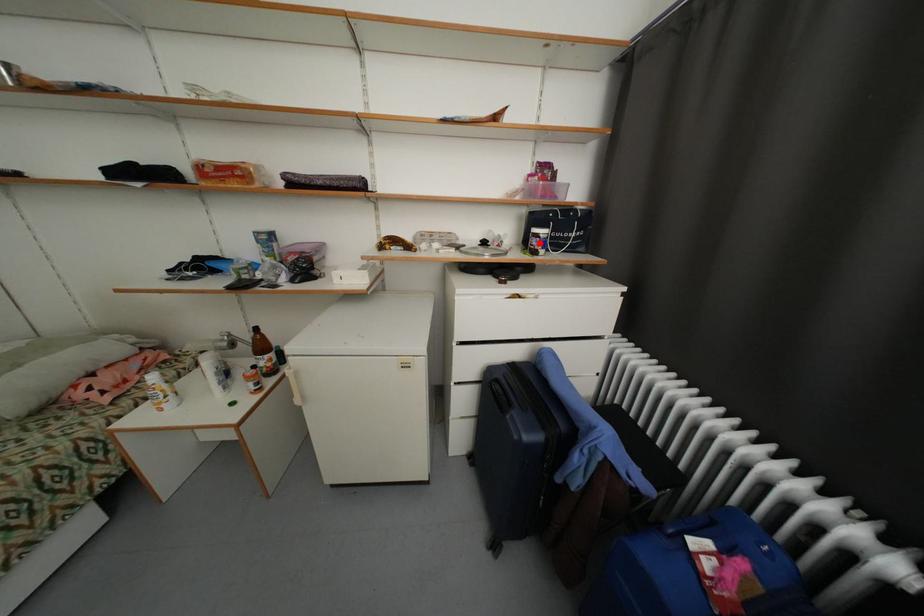
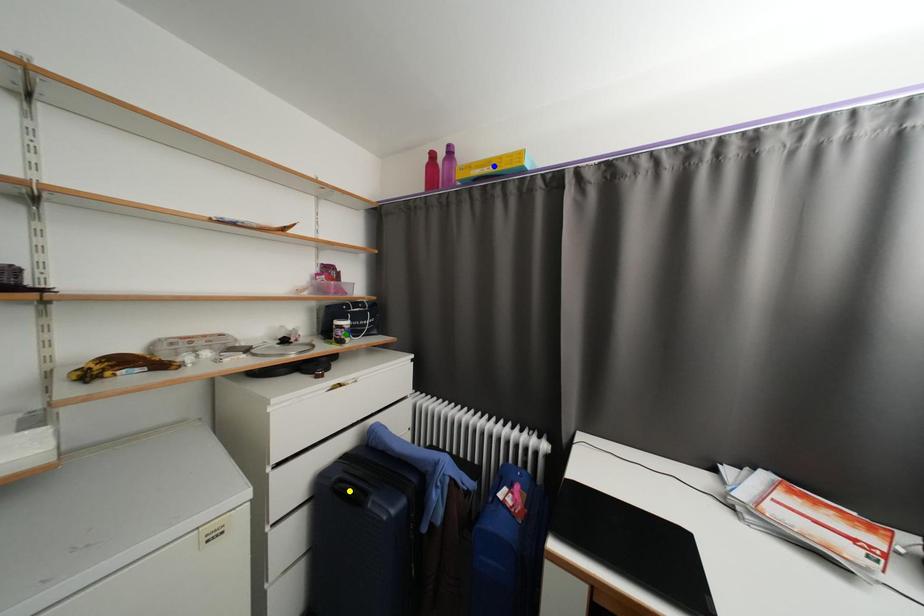
Question: I am providing you with two images of the same scene from different viewpoints. A red point is marked on the first image. You are given multiple points on the second image. Can you choose the point in image 2 that corresponds to the point in image 1?

Choices:
 (A) green point
 (B) yellow point
 (C) blue point

Answer: (A)